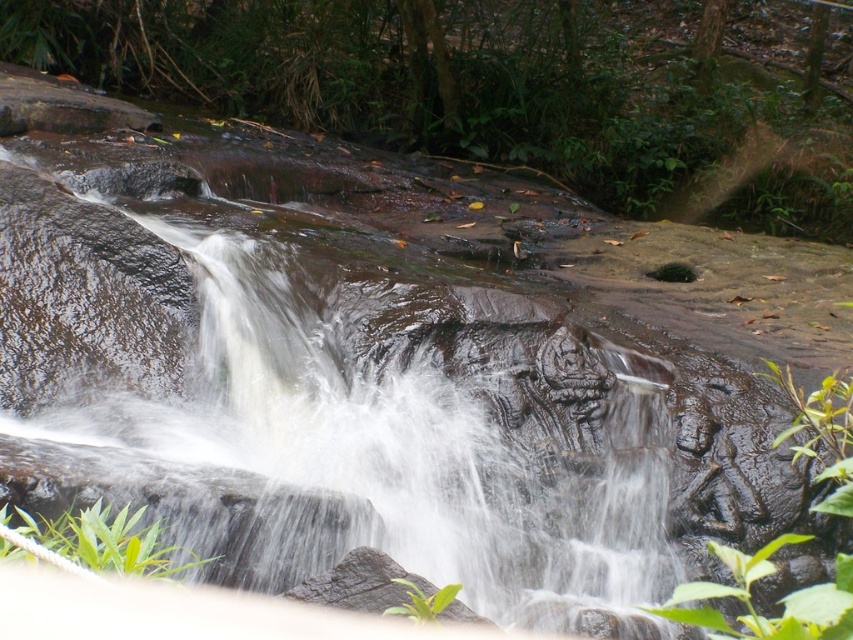
You are a hiker who needs to cross the waterfall area. You see the smooth brown rock at center and the green matte rock at center. Which rock is bigger and would provide a safer stepping stone?

The smooth brown rock at center is larger in size compared to the green matte rock at center, so it would provide a safer stepping stone for crossing the waterfall area.